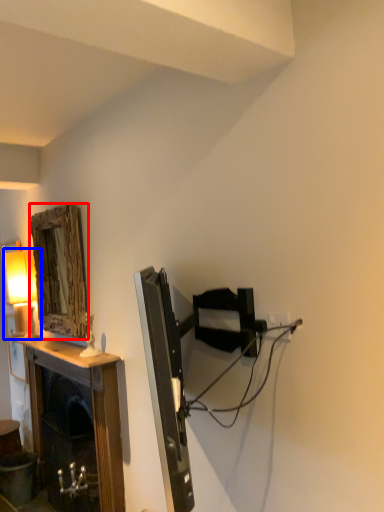
Question: Which object is closer to the camera taking this photo, mirror (highlighted by a red box) or table lamp (highlighted by a blue box)?

Choices:
 (A) mirror
 (B) table lamp

Answer: (A)